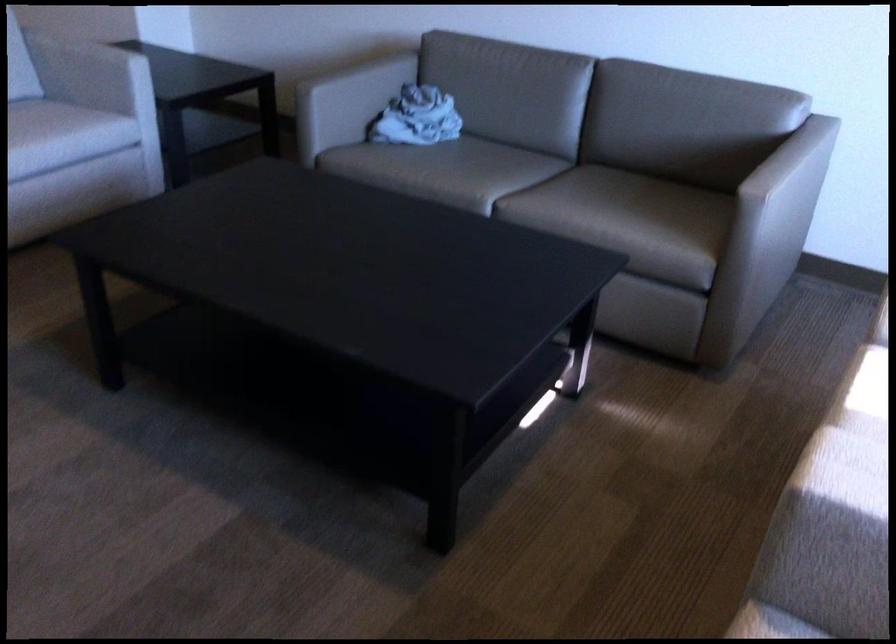
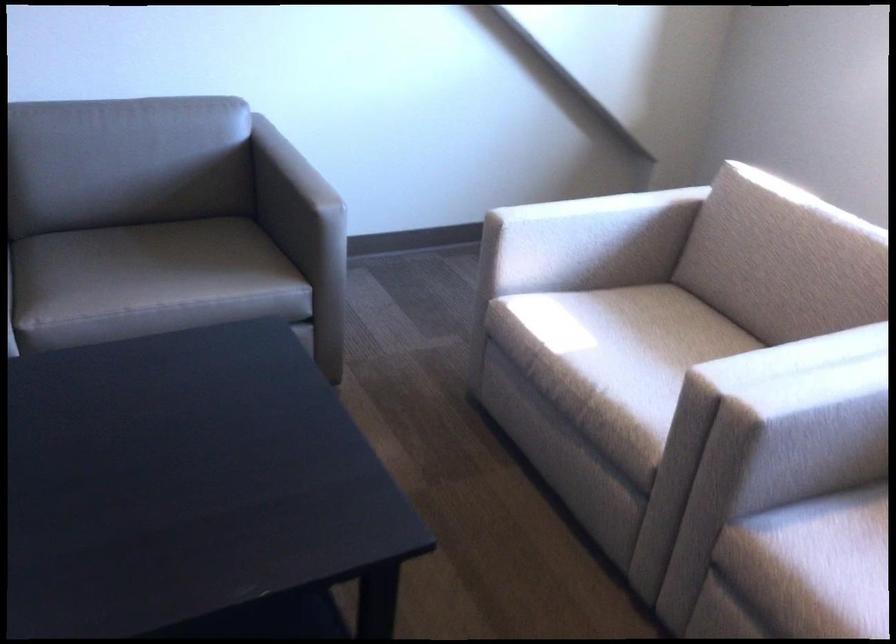
Question: The camera is either moving clockwise (left) or counter-clockwise (right) around the object. The first image is from the beginning of the video and the second image is from the end. Is the camera moving left or right when shooting the video?

Choices:
 (A) Left
 (B) Right

Answer: (A)